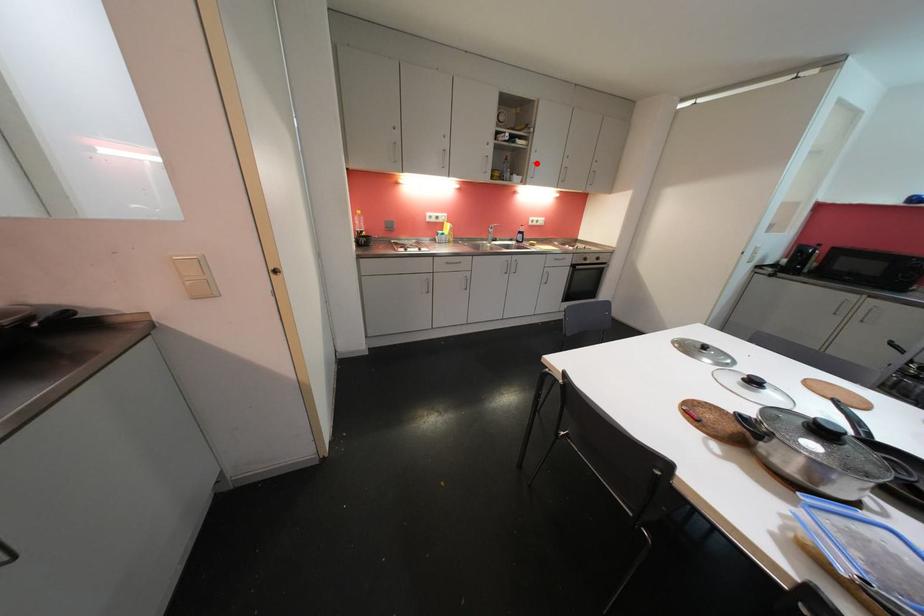
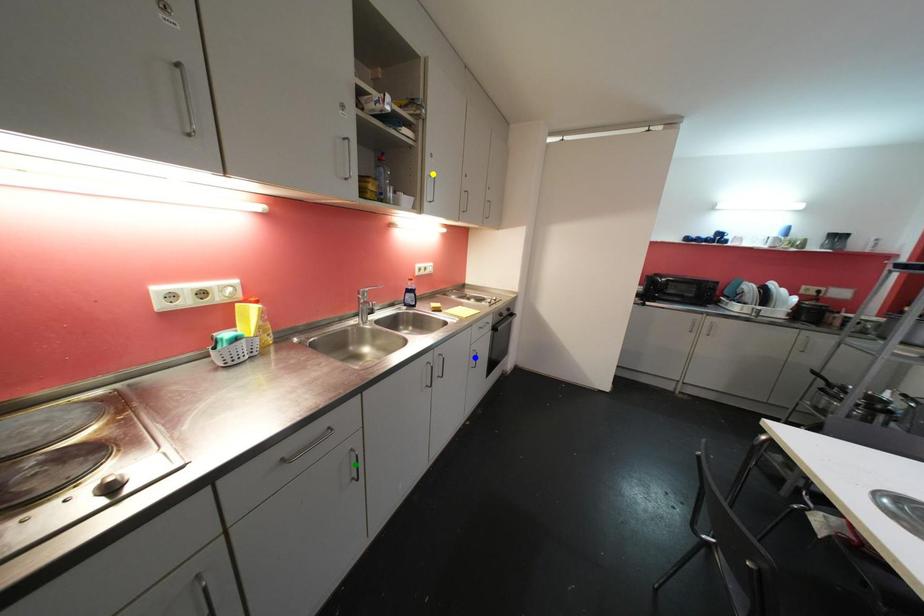
Question: I am providing you with two images of the same scene from different viewpoints. A red point is marked on the first image. You are given multiple points on the second image. Can you choose the point in image 2 that corresponds to the point in image 1?

Choices:
 (A) green point
 (B) blue point
 (C) yellow point

Answer: (C)